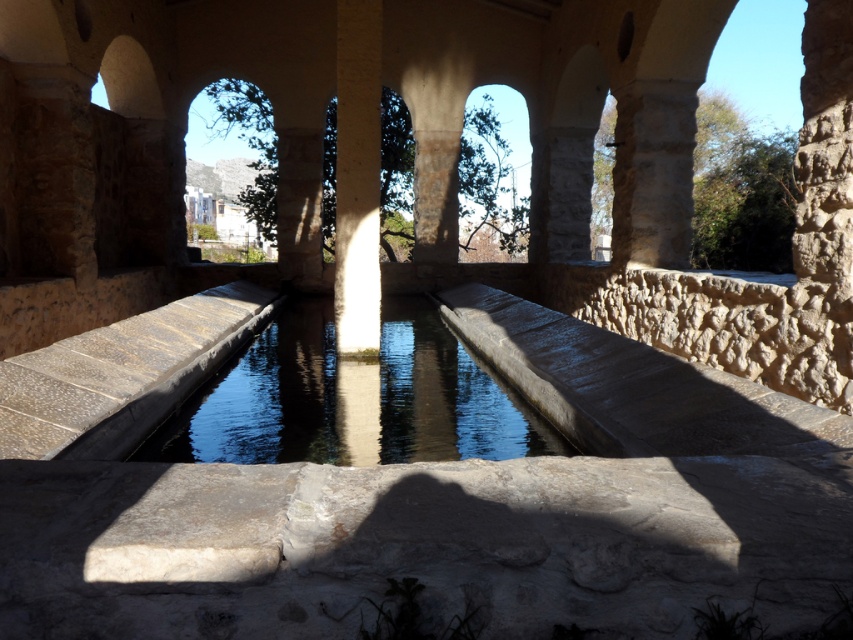
You are a landscape architect designing a new garden pathway. You need to place a decorative stone statue that is 1 meter wide between the clear stone water at center and the white stone pillar at center. Based on their sizes, will the statue fit between them without overlapping either object?

The clear stone water at center has a smaller size compared to the white stone pillar at center. Since the statue is 1 meter wide, it depends on the actual distance between them. However, the description only provides size comparison, not the distance. Therefore, we cannot determine if the statue will fit without additional information about the spacing between the two objects.

You are standing at the edge of the channel and see the point labeled as point (352, 397). Based on the scene description, can you determine if this point is located on the water or on the stone structure?

The point (352, 397) is on clear stone water at center, so it is located on the water surface which is part of the stone structure channel.

You are a photographer standing at the edge of the channel in the scene. You want to capture a reflection of the columns in the clear stone water at center. Based on the water location, will you need to move closer to the water or further away to ensure the reflection is centered in your shot?

The clear stone water at center is located at coordinates point (352, 397), so you need to move closer to the water to ensure the reflection is centered in your shot.